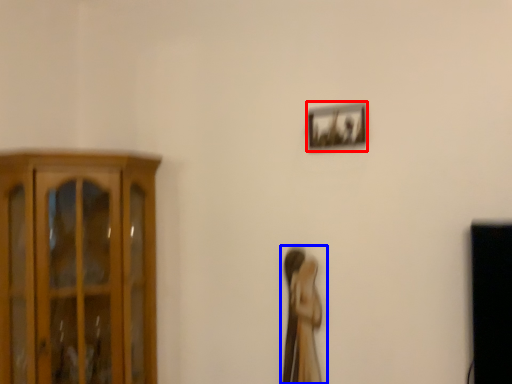
Question: Which of the following is the farthest to the observer, picture frame (highlighted by a red box) or woman (highlighted by a blue box)?

Choices:
 (A) picture frame
 (B) woman

Answer: (B)